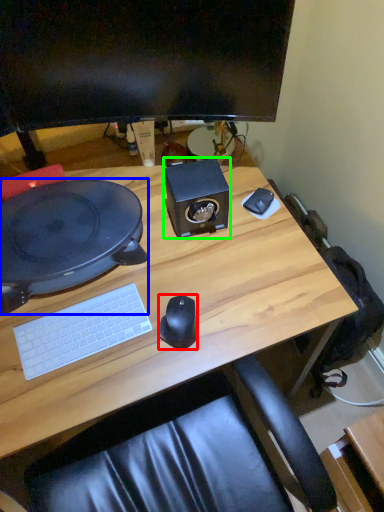
Question: Which object is the closest to the mouse (highlighted by a red box)? Choose among these: desktop (highlighted by a blue box) or speaker (highlighted by a green box).

Choices:
 (A) desktop
 (B) speaker

Answer: (B)